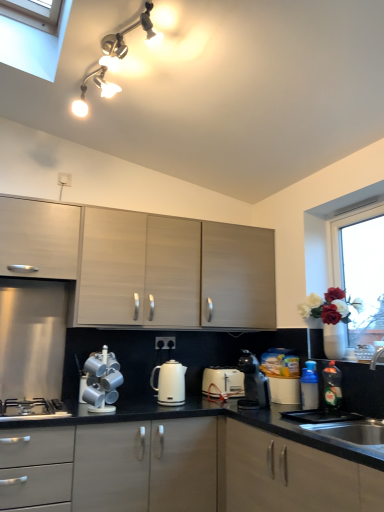
Question: Should I look upward or downward to see matte white light fixture at upper center?

Choices:
 (A) down
 (B) up

Answer: (B)

Question: From a real-world perspective, is silver metallic mugs at lower center, the 1th appliance positioned from the left, over matte wood cabinets at center, arranged as the second cabinetry when viewed from the top?

Choices:
 (A) no
 (B) yes

Answer: (A)

Question: Is there a large distance between silver metallic mugs at lower center, positioned as the second appliance in back-to-front order, and matte wood cabinets at center, the second cabinetry from the bottom?

Choices:
 (A) no
 (B) yes

Answer: (A)

Question: Considering the relative sizes of silver metallic mugs at lower center, the 1th appliance positioned from the left, and matte wood cabinets at center, the second cabinetry from the bottom, in the image provided, is silver metallic mugs at lower center, the 1th appliance positioned from the left, wider than matte wood cabinets at center, the second cabinetry from the bottom,?

Choices:
 (A) yes
 (B) no

Answer: (B)

Question: Does silver metallic mugs at lower center, positioned as the second appliance in back-to-front order, have a smaller size compared to matte wood cabinets at center, arranged as the second cabinetry when viewed from the top?

Choices:
 (A) yes
 (B) no

Answer: (A)

Question: Is silver metallic mugs at lower center, the 1th appliance positioned from the left, facing towards matte wood cabinets at center, arranged as the second cabinetry when viewed from the top?

Choices:
 (A) no
 (B) yes

Answer: (A)

Question: Can you confirm if silver metallic mugs at lower center, the 1th appliance positioned from the left, is taller than matte wood cabinets at center, the second cabinetry from the bottom?

Choices:
 (A) yes
 (B) no

Answer: (B)

Question: Is black plastic coffee maker at center, which is the 2th kitchen appliance from left to right, shorter than silver metallic mugs at lower center, which ranks as the first appliance in front-to-back order?

Choices:
 (A) no
 (B) yes

Answer: (B)

Question: Is black plastic coffee maker at center, the 1th kitchen appliance in the right-to-left sequence, oriented towards silver metallic mugs at lower center, positioned as the second appliance in back-to-front order?

Choices:
 (A) no
 (B) yes

Answer: (B)

Question: From a real-world perspective, is black plastic coffee maker at center, which is the 2th kitchen appliance from left to right, under silver metallic mugs at lower center, the 1th appliance positioned from the left?

Choices:
 (A) no
 (B) yes

Answer: (B)

Question: From a real-world perspective, does black plastic coffee maker at center, the 1th kitchen appliance in the right-to-left sequence, stand above silver metallic mugs at lower center, which ranks as the first appliance in front-to-back order?

Choices:
 (A) yes
 (B) no

Answer: (B)

Question: Is black plastic coffee maker at center, the 1th kitchen appliance in the right-to-left sequence, far from silver metallic mugs at lower center, the 1th appliance positioned from the left?

Choices:
 (A) no
 (B) yes

Answer: (A)

Question: Does black plastic coffee maker at center, the 1th kitchen appliance in the right-to-left sequence, lie behind silver metallic mugs at lower center, which is the second appliance from right to left?

Choices:
 (A) no
 (B) yes

Answer: (B)

Question: Is matte white cabinet at upper left, the 3th cabinetry from the bottom, inside green glossy bottle at lower right, the second bottle in the left-to-right sequence?

Choices:
 (A) no
 (B) yes

Answer: (A)